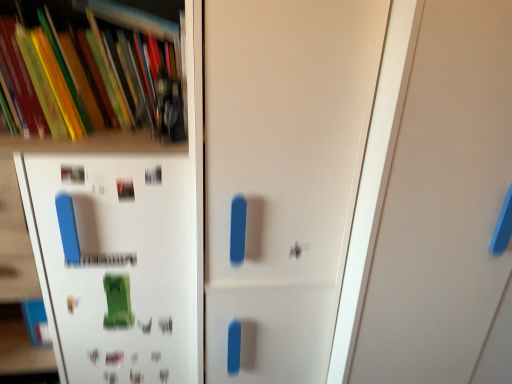
At what (x,y) coordinates should I click in order to perform the action: click on white matte door at center, which ranks as the first door in right-to-left order. Please return your answer as a coordinate pair (x, y). The height and width of the screenshot is (384, 512). Looking at the image, I should click on (443, 203).

Where is `matte plastic books at upper left`? The width and height of the screenshot is (512, 384). matte plastic books at upper left is located at coordinates (104, 71).

Which is in front, point (375, 32) or point (19, 217)?

The point (375, 32) is more forward.

From a real-world perspective, is matte white door at center, marked as the 1th door in a left-to-right arrangement, located beneath white matte shelf at upper left?

No, from a real-world perspective, matte white door at center, marked as the 1th door in a left-to-right arrangement, is not below white matte shelf at upper left.

From the picture: Considering the sizes of objects matte white door at center, marked as the 1th door in a left-to-right arrangement, and white matte shelf at upper left in the image provided, who is shorter, matte white door at center, marked as the 1th door in a left-to-right arrangement, or white matte shelf at upper left?

Standing shorter between the two is white matte shelf at upper left.

From the image's perspective, is white matte door at center, which ranks as the first door in right-to-left order, above or below matte white door at center, marked as the 1th door in a left-to-right arrangement?

Based on their image positions, white matte door at center, which ranks as the first door in right-to-left order, is located beneath matte white door at center, marked as the 1th door in a left-to-right arrangement.

Considering the relative sizes of white matte door at center, acting as the second door starting from the left, and matte white door at center, marked as the 1th door in a left-to-right arrangement, in the image provided, is white matte door at center, acting as the second door starting from the left, taller than matte white door at center, marked as the 1th door in a left-to-right arrangement,?

Incorrect, the height of white matte door at center, acting as the second door starting from the left, is not larger of that of matte white door at center, marked as the 1th door in a left-to-right arrangement.

Does white matte door at center, acting as the second door starting from the left, appear on the right side of matte white door at center, marked as the 1th door in a left-to-right arrangement?

Yes.

Is white matte door at center, which ranks as the first door in right-to-left order, next to matte white door at center, marked as the 1th door in a left-to-right arrangement, and touching it?

There is a gap between white matte door at center, which ranks as the first door in right-to-left order, and matte white door at center, marked as the 1th door in a left-to-right arrangement.

Considering the sizes of objects white matte shelf at upper left and white matte door at center, which ranks as the first door in right-to-left order, in the image provided, who is taller, white matte shelf at upper left or white matte door at center, which ranks as the first door in right-to-left order,?

white matte door at center, which ranks as the first door in right-to-left order.

At what (x,y) coordinates should I click in order to perform the action: click on shelf to the left of white matte door at center, which ranks as the first door in right-to-left order. Please return your answer as a coordinate pair (x, y). Looking at the image, I should click on (108, 210).

Are white matte shelf at upper left and white matte door at center, acting as the second door starting from the left, beside each other?

No, white matte shelf at upper left is not making contact with white matte door at center, acting as the second door starting from the left.

From the image's perspective, which is below, white matte shelf at upper left or white matte door at center, acting as the second door starting from the left?

white matte door at center, acting as the second door starting from the left, from the image's perspective.

Is white matte door at center, acting as the second door starting from the left, oriented away from matte plastic books at upper left?

No, matte plastic books at upper left is not at the back of white matte door at center, acting as the second door starting from the left.

From the image's perspective, is white matte door at center, which ranks as the first door in right-to-left order, located above or below matte plastic books at upper left?

Clearly, from the image's perspective, white matte door at center, which ranks as the first door in right-to-left order, is below matte plastic books at upper left.

Can you confirm if white matte door at center, which ranks as the first door in right-to-left order, is thinner than matte plastic books at upper left?

In fact, white matte door at center, which ranks as the first door in right-to-left order, might be wider than matte plastic books at upper left.

From the picture: From a real-world perspective, is white matte door at center, acting as the second door starting from the left, on matte plastic books at upper left?

No.

Considering the sizes of matte white door at center, the 2th door from the right, and white matte door at center, acting as the second door starting from the left, in the image, is matte white door at center, the 2th door from the right, wider or thinner than white matte door at center, acting as the second door starting from the left,?

In the image, matte white door at center, the 2th door from the right, appears to be more narrow than white matte door at center, acting as the second door starting from the left.

Is matte white door at center, the 2th door from the right, positioned with its back to white matte door at center, which ranks as the first door in right-to-left order?

matte white door at center, the 2th door from the right, is not turned away from white matte door at center, which ranks as the first door in right-to-left order.

Is there a large distance between matte white door at center, marked as the 1th door in a left-to-right arrangement, and white matte door at center, acting as the second door starting from the left?

matte white door at center, marked as the 1th door in a left-to-right arrangement, is actually quite close to white matte door at center, acting as the second door starting from the left.

In the scene shown: From the image's perspective, who appears lower, white matte shelf at upper left or matte plastic books at upper left?

white matte shelf at upper left.

Would you say white matte shelf at upper left is inside or outside matte plastic books at upper left?

white matte shelf at upper left exists outside the volume of matte plastic books at upper left.

Are white matte shelf at upper left and matte plastic books at upper left located far from each other?

They are positioned close to each other.

How different are the orientations of white matte shelf at upper left and matte plastic books at upper left in degrees?

There is a 1.62-degree angle between the facing directions of white matte shelf at upper left and matte plastic books at upper left.

Could white matte door at center, acting as the second door starting from the left, be considered to be inside matte plastic books at upper left?

No, matte plastic books at upper left does not contain white matte door at center, acting as the second door starting from the left.

Is matte plastic books at upper left next to white matte door at center, acting as the second door starting from the left?

matte plastic books at upper left and white matte door at center, acting as the second door starting from the left, are not in contact.

Is matte plastic books at upper left oriented away from white matte door at center, acting as the second door starting from the left?

No, matte plastic books at upper left's orientation is not away from white matte door at center, acting as the second door starting from the left.

Which object is positioned more to the right, matte plastic books at upper left or white matte door at center, which ranks as the first door in right-to-left order?

Positioned to the right is white matte door at center, which ranks as the first door in right-to-left order.

From a real-world perspective, count 1st doors upward from the white matte shelf at upper left and point to it. Please provide its 2D coordinates.

[(283, 174)]

Identify the location of door behind the white matte door at center, acting as the second door starting from the left. (283, 174).

Looking at the image, which one is located closer to white matte shelf at upper left, matte white door at center, marked as the 1th door in a left-to-right arrangement, or matte plastic books at upper left?

matte plastic books at upper left is positioned closer to the anchor white matte shelf at upper left.

Estimate the real-world distances between objects in this image. Which object is further from matte plastic books at upper left, white matte door at center, acting as the second door starting from the left, or matte white door at center, marked as the 1th door in a left-to-right arrangement?

white matte door at center, acting as the second door starting from the left, is positioned further to the anchor matte plastic books at upper left.

Considering their positions, is white matte door at center, acting as the second door starting from the left, positioned further to matte plastic books at upper left than white matte shelf at upper left?

white matte door at center, acting as the second door starting from the left, is further to matte plastic books at upper left.

Estimate the real-world distances between objects in this image. Which object is further from white matte door at center, which ranks as the first door in right-to-left order, matte plastic books at upper left or white matte shelf at upper left?

matte plastic books at upper left lies further to white matte door at center, which ranks as the first door in right-to-left order, than the other object.

Based on their spatial positions, is matte plastic books at upper left or matte white door at center, the 2th door from the right, closer to white matte door at center, which ranks as the first door in right-to-left order?

matte white door at center, the 2th door from the right, is closer to white matte door at center, which ranks as the first door in right-to-left order.

From the image, which object appears to be nearer to matte white door at center, marked as the 1th door in a left-to-right arrangement, white matte door at center, which ranks as the first door in right-to-left order, or white matte shelf at upper left?

The object closer to matte white door at center, marked as the 1th door in a left-to-right arrangement, is white matte shelf at upper left.

Looking at the image, which one is located further to matte white door at center, the 2th door from the right, white matte shelf at upper left or matte plastic books at upper left?

matte plastic books at upper left is further to matte white door at center, the 2th door from the right.

Estimate the real-world distances between objects in this image. Which object is closer to white matte shelf at upper left, matte plastic books at upper left or matte white door at center, marked as the 1th door in a left-to-right arrangement?

Based on the image, matte plastic books at upper left appears to be nearer to white matte shelf at upper left.

At what (x,y) coordinates should I click in order to perform the action: click on book situated between white matte shelf at upper left and matte white door at center, the 2th door from the right, from left to right. Please return your answer as a coordinate pair (x, y). The height and width of the screenshot is (384, 512). Looking at the image, I should click on (104, 71).

Image resolution: width=512 pixels, height=384 pixels. Find the location of `door between white matte shelf at upper left and white matte door at center, which ranks as the first door in right-to-left order`. door between white matte shelf at upper left and white matte door at center, which ranks as the first door in right-to-left order is located at coordinates (283, 174).

Locate an element on the screen. This screenshot has width=512, height=384. door located between matte plastic books at upper left and white matte door at center, acting as the second door starting from the left, in the left-right direction is located at coordinates (283, 174).

Locate an element on the screen. book between white matte shelf at upper left and white matte door at center, which ranks as the first door in right-to-left order, in the horizontal direction is located at coordinates (104, 71).